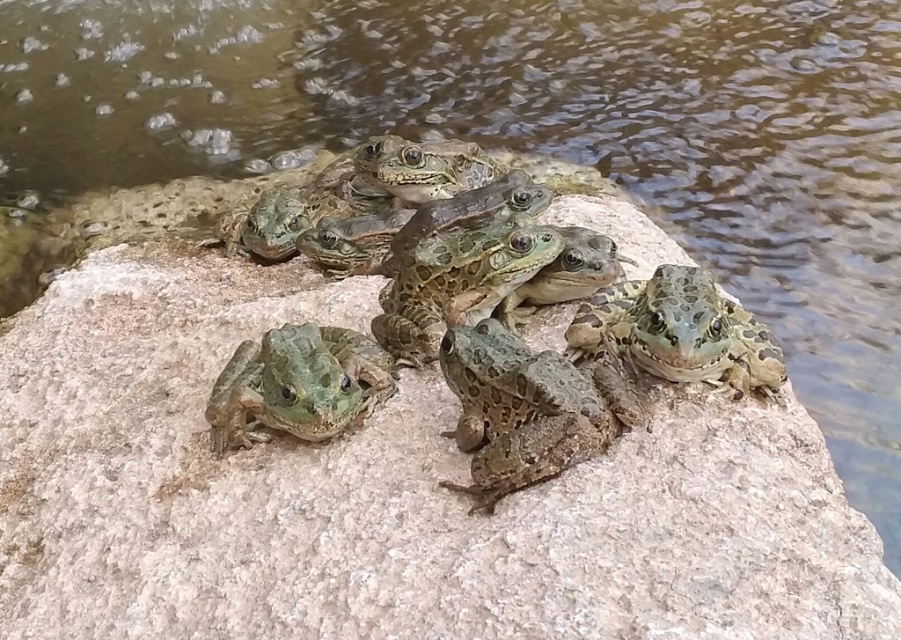
Question: Among these objects, which one is farthest from the camera?

Choices:
 (A) green textured frog at center
 (B) speckled brown skin at center
 (C) green spotted frogs at center

Answer: (A)

Question: Which is farther from the green spotted frogs at center?

Choices:
 (A) green textured frog at center
 (B) speckled brown skin at center

Answer: (A)

Question: Is green spotted frogs at center above speckled brown skin at center?

Choices:
 (A) yes
 (B) no

Answer: (A)

Question: Does green spotted frogs at center have a larger size compared to speckled brown skin at center?

Choices:
 (A) yes
 (B) no

Answer: (A)

Question: Which point appears farthest from the camera in this image?

Choices:
 (A) (517, 342)
 (B) (499, 346)

Answer: (A)

Question: Can you confirm if green spotted frogs at center is positioned above speckled brown skin at center?

Choices:
 (A) no
 (B) yes

Answer: (B)